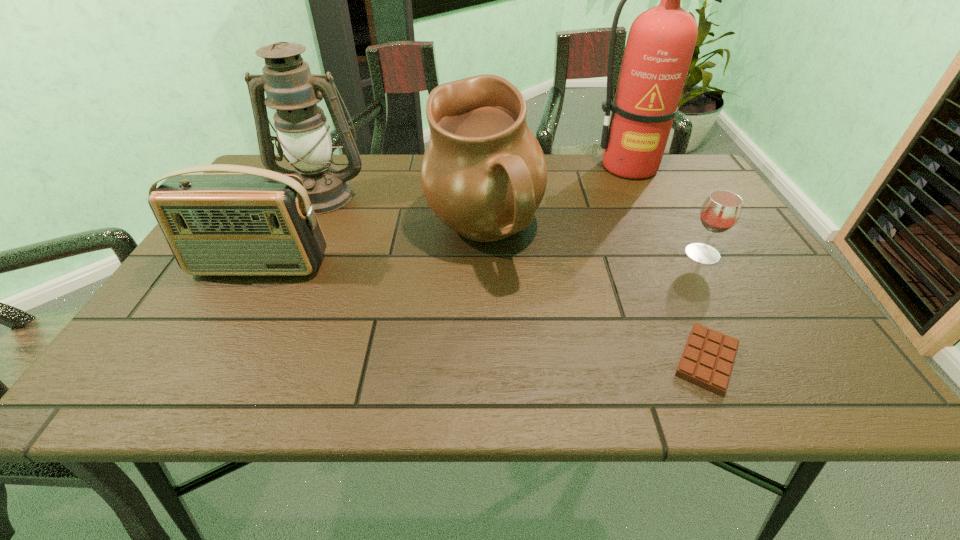
This screenshot has height=540, width=960. Find the location of `oil lamp that is at the left edge`. oil lamp that is at the left edge is located at coordinates (303, 135).

The image size is (960, 540). What are the coordinates of `radio receiver present at the left edge` in the screenshot? It's located at (252, 222).

In order to click on fire extinguisher positioned at the right edge in this screenshot , I will do (x=661, y=41).

At what (x,y) coordinates should I click in order to perform the action: click on wineglass present at the right edge. Please return your answer as a coordinate pair (x, y). The image size is (960, 540). Looking at the image, I should click on (721, 210).

Where is `object present at the far left corner`? The height and width of the screenshot is (540, 960). object present at the far left corner is located at coordinates (303, 135).

Where is `object located at the far right corner`? The height and width of the screenshot is (540, 960). object located at the far right corner is located at coordinates click(661, 41).

At what (x,y) coordinates should I click in order to perform the action: click on vacant region at the far edge. Please return your answer as a coordinate pair (x, y). Looking at the image, I should click on (357, 180).

The width and height of the screenshot is (960, 540). Find the location of `vacant area at the near edge`. vacant area at the near edge is located at coordinates (322, 390).

Identify the location of vacant space at the right edge. (782, 353).

The height and width of the screenshot is (540, 960). Identify the location of vacant space at the far right corner. (713, 187).